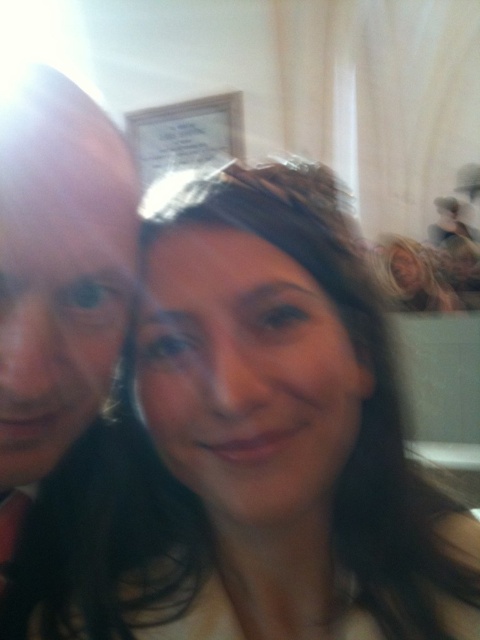
Question: From the image, what is the correct spatial relationship of matte black hair at left in relation to blonde hair at upper right?

Choices:
 (A) below
 (B) above

Answer: (A)

Question: Which point appears farthest from the camera in this image?

Choices:
 (A) (374, 248)
 (B) (19, 356)
 (C) (11, 616)
 (D) (199, 301)

Answer: (A)

Question: Which object is closer to the camera taking this photo?

Choices:
 (A) black silk tie at left
 (B) dark brown hair at center
 (C) blonde hair at upper right

Answer: (B)

Question: Which point is farther from the camera taking this photo?

Choices:
 (A) (129, 164)
 (B) (412, 300)
 (C) (8, 628)

Answer: (B)

Question: Is blonde hair at upper right below black silk tie at left?

Choices:
 (A) yes
 (B) no

Answer: (B)

Question: Does dark brown hair at center appear under blonde hair at upper right?

Choices:
 (A) no
 (B) yes

Answer: (B)